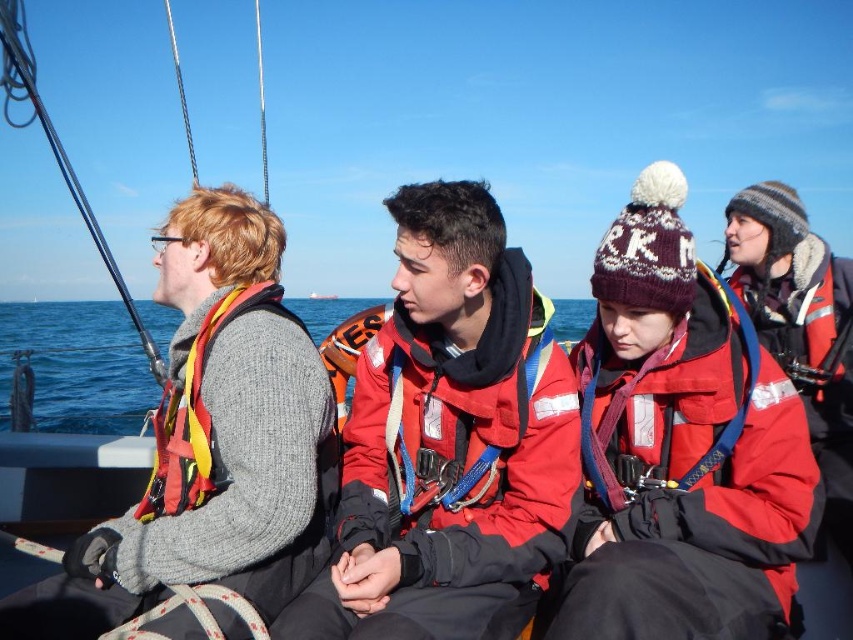
Question: Among these objects, which one is nearest to the camera?

Choices:
 (A) red matte jacket at center
 (B) matte red life jacket at right
 (C) knitted gray sweater at left

Answer: (C)

Question: Observing the image, what is the correct spatial positioning of knitted gray sweater at left in reference to matte red life jacket at right?

Choices:
 (A) right
 (B) left

Answer: (B)

Question: Is red matte jacket at center to the right of matte red life jacket at right from the viewer's perspective?

Choices:
 (A) no
 (B) yes

Answer: (A)

Question: Which object is positioned farthest from the knitted gray sweater at left?

Choices:
 (A) matte red life jacket at right
 (B) red matte jacket at center

Answer: (A)

Question: Is red matte jacket at center positioned at the back of knitted gray sweater at left?

Choices:
 (A) yes
 (B) no

Answer: (A)

Question: Which object is positioned farthest from the knitted gray sweater at left?

Choices:
 (A) red matte jacket at center
 (B) matte red life jacket at right

Answer: (B)